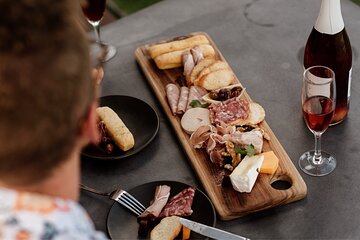
I want to click on small black plates, so click(x=145, y=193), click(x=134, y=121).